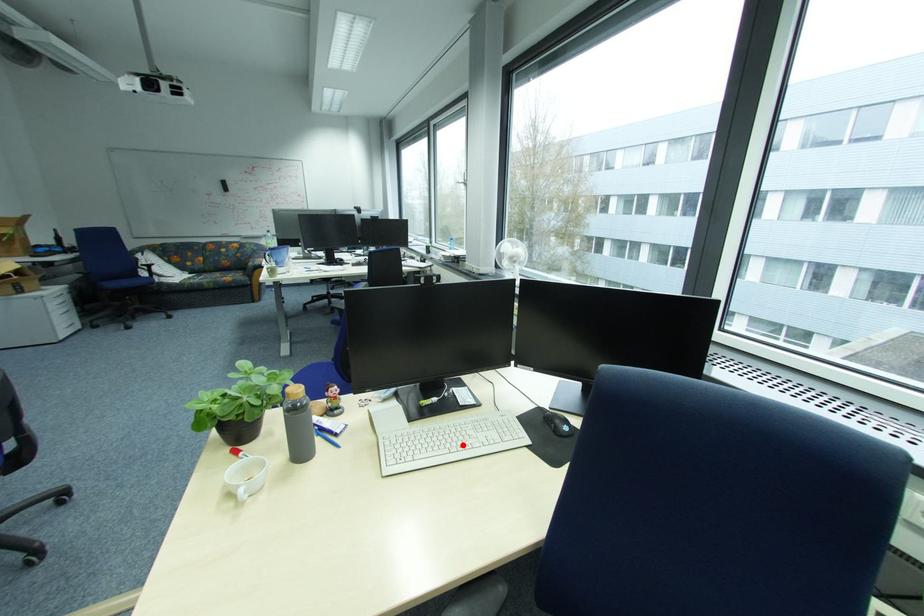
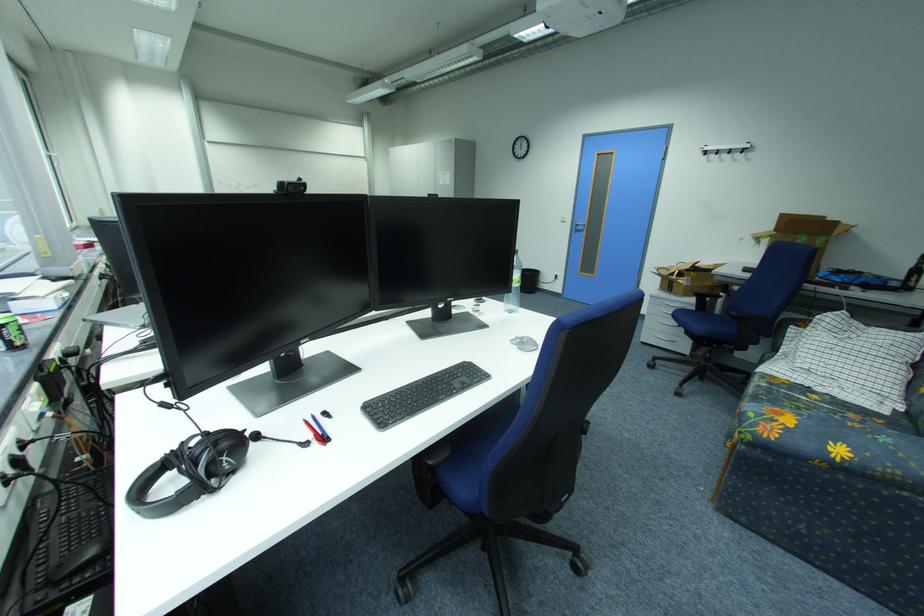
Question: I am providing you with two images of the same scene from different viewpoints. A red point is marked on the first image. Can you still see the location of the red point in image 2?

Choices:
 (A) Yes
 (B) No

Answer: (B)